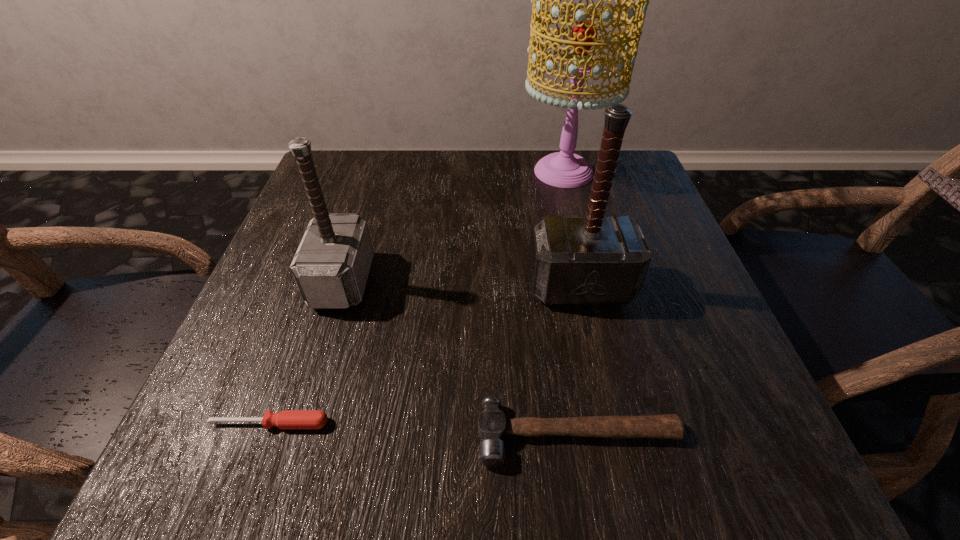
Image resolution: width=960 pixels, height=540 pixels. I want to click on the third closest hammer to the tallest object, so click(492, 425).

In order to click on hammer that can be found as the second closest to the tallest hammer in this screenshot , I will do `click(331, 266)`.

Find the location of a particular element. This screenshot has width=960, height=540. free location that satisfies the following two spatial constraints: 1. on the back side of the farthest object; 2. on the left side of the tallest hammer is located at coordinates (554, 172).

At what (x,y) coordinates should I click in order to perform the action: click on vacant area that satisfies the following two spatial constraints: 1. for striking with the head of the fourth shortest object; 2. on the right side of the third shortest object. Please return your answer as a coordinate pair (x, y). Image resolution: width=960 pixels, height=540 pixels. Looking at the image, I should click on (341, 286).

The image size is (960, 540). Identify the location of free spot that satisfies the following two spatial constraints: 1. for striking with the head of the third tallest object; 2. on the left side of the second tallest object. (341, 286).

Locate an element on the screen. The height and width of the screenshot is (540, 960). free spot that satisfies the following two spatial constraints: 1. on the back side of the fourth shortest object; 2. for striking with the head of the leftmost hammer is located at coordinates (579, 281).